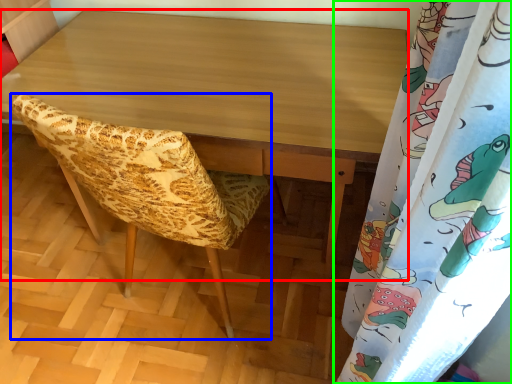
Question: Which is farther away from desk (highlighted by a red box)? furniture (highlighted by a blue box) or curtain (highlighted by a green box)?

Choices:
 (A) furniture
 (B) curtain

Answer: (B)